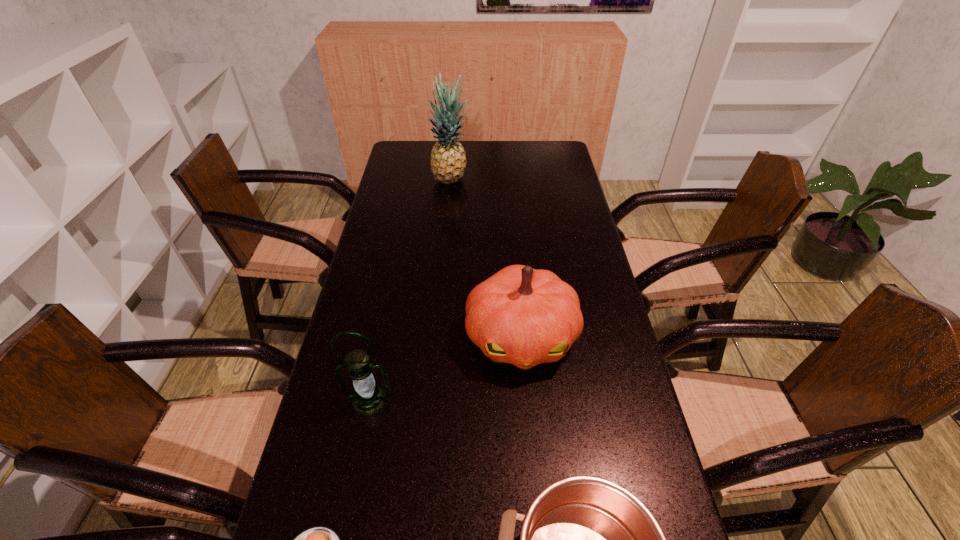
Where is `pineapple`? pineapple is located at coordinates (448, 160).

The image size is (960, 540). I want to click on the farthest object, so click(448, 160).

Find the location of a particular element. the fourth nearest object is located at coordinates (521, 316).

The width and height of the screenshot is (960, 540). Find the location of `the third nearest object`. the third nearest object is located at coordinates click(x=369, y=398).

The width and height of the screenshot is (960, 540). In order to click on blank space located on the left of the farthest object in this screenshot , I will do `click(419, 181)`.

Find the location of a particular element. blank space located on the front-facing side of the pumpkin is located at coordinates (533, 474).

At what (x,y) coordinates should I click in order to perform the action: click on vacant space located on the side where the third farthest object emits light. Please return your answer as a coordinate pair (x, y). Looking at the image, I should click on (360, 445).

Locate an element on the screen. The image size is (960, 540). object that is at the left edge is located at coordinates (369, 398).

Where is `object present at the right edge`? object present at the right edge is located at coordinates (521, 316).

In the image, there is a desktop. Where is `free space at the far edge`? free space at the far edge is located at coordinates (496, 159).